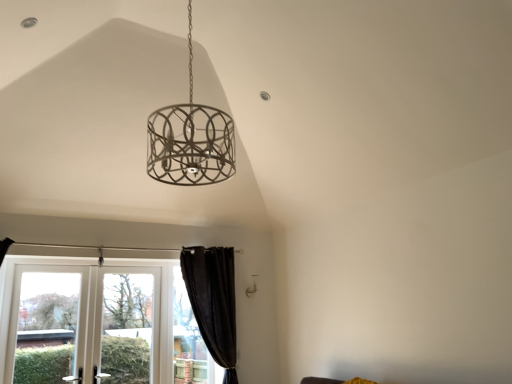
Question: From a real-world perspective, relative to clear glass screen door at lower left, is white plastic window at lower left, the second window when ordered from left to right, vertically above or below?

Choices:
 (A) above
 (B) below

Answer: (B)

Question: Considering their positions, is white plastic window at lower left, the second window when ordered from left to right, located in front of or behind clear glass screen door at lower left?

Choices:
 (A) behind
 (B) front

Answer: (B)

Question: Which object is positioned closest to the white glass door at lower left, the 3th window when ordered from right to left?

Choices:
 (A) black velvet curtain at lower left
 (B) clear glass screen door at lower left
 (C) white plastic window at lower left, positioned as the second window in right-to-left order
 (D) black curtain at lower left, which is counted as the first window, starting from the right

Answer: (C)

Question: Estimate the real-world distances between objects in this image. Which object is farther from the white glass door at lower left, the 3th window when ordered from right to left?

Choices:
 (A) black curtain at lower left, which is counted as the first window, starting from the right
 (B) clear glass screen door at lower left
 (C) black velvet curtain at lower left
 (D) white plastic window at lower left, the second window when ordered from left to right

Answer: (C)